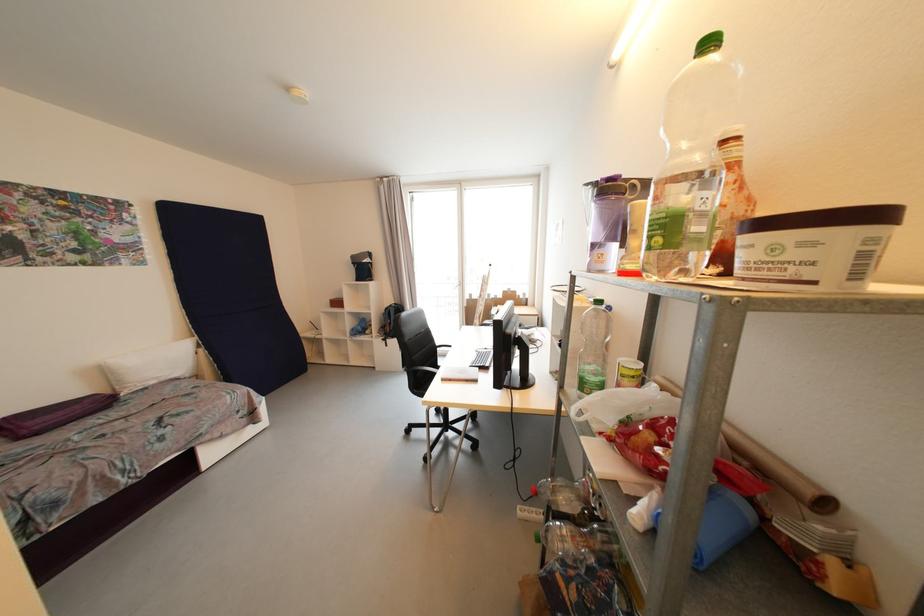
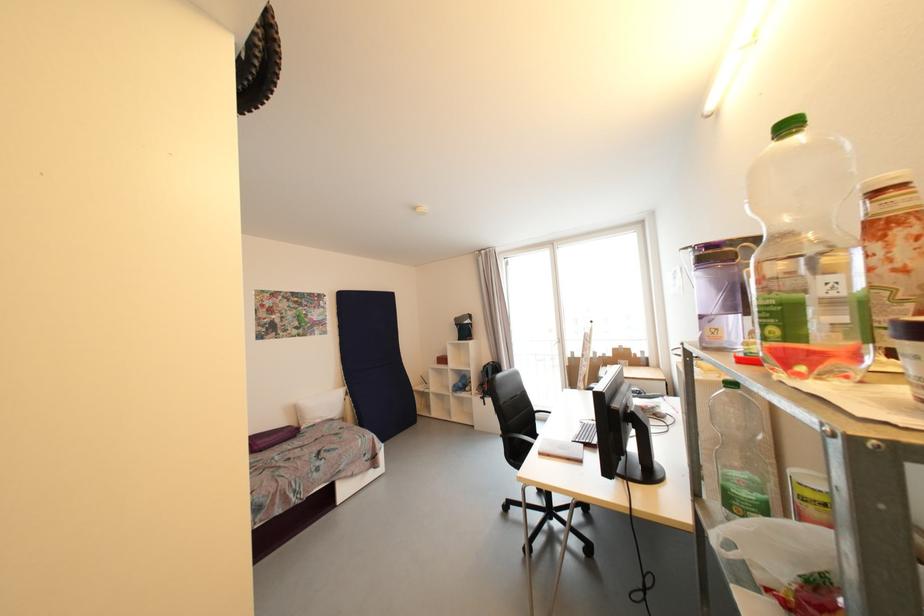
In the second image, find the point that corresponds to the point at 663,241 in the first image.

(780, 331)